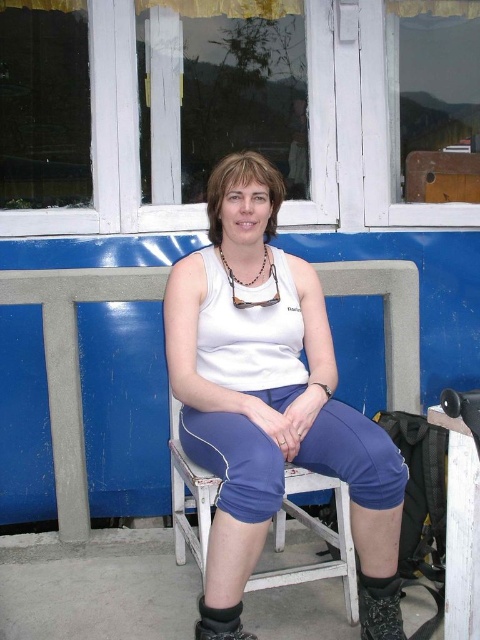
Between white matte tank top at center and black suede boot at lower center, which one has more height?

With more height is white matte tank top at center.

Who is more distant from viewer, (x=264, y=164) or (x=212, y=636)?

Positioned behind is point (x=264, y=164).

Find the location of a particular element. white matte tank top at center is located at coordinates (266, 385).

At what (x,y) coordinates should I click in order to perform the action: click on white matte tank top at center. Please return your answer as a coordinate pair (x, y). The width and height of the screenshot is (480, 640). Looking at the image, I should click on (266, 385).

Consider the image. Does white matte tank top at center have a lesser width compared to black mesh boot at lower right?

No, white matte tank top at center is not thinner than black mesh boot at lower right.

Which is in front, point (286, 342) or point (368, 604)?

Point (368, 604)

The width and height of the screenshot is (480, 640). In order to click on white matte tank top at center in this screenshot , I will do `click(266, 385)`.

Does black mesh boot at lower right appear on the right side of black suede boot at lower center?

Yes, black mesh boot at lower right is to the right of black suede boot at lower center.

Is point (371, 605) positioned before point (211, 625)?

No.

Locate an element on the screen. This screenshot has height=640, width=480. black mesh boot at lower right is located at coordinates (380, 608).